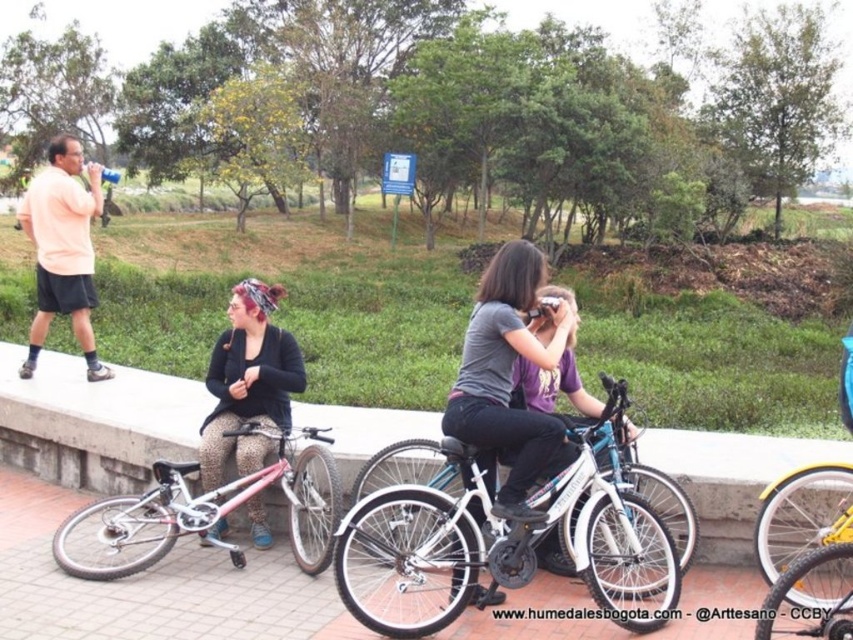
Between point (45, 349) and point (595, 534), which one is positioned behind?

Positioned behind is point (45, 349).

Between concrete ledge at center and white matte bicycle at center, which one has less height?

concrete ledge at center

Does point (836, 454) come behind point (469, 564)?

Yes, it is.

At what (x,y) coordinates should I click in order to perform the action: click on concrete ledge at center. Please return your answer as a coordinate pair (x, y). The height and width of the screenshot is (640, 853). Looking at the image, I should click on (94, 420).

Which is more to the right, matte gray shirt at center or leopard print pants at center?

From the viewer's perspective, matte gray shirt at center appears more on the right side.

Who is more distant from viewer, (512, 320) or (241, 408)?

The point (241, 408) is behind.

Image resolution: width=853 pixels, height=640 pixels. Identify the location of matte gray shirt at center. (506, 378).

The width and height of the screenshot is (853, 640). Identify the location of matte gray shirt at center. (506, 378).

Which is above, white matte bicycle at center or leopard print pants at center?

Positioned higher is leopard print pants at center.

Can you confirm if white matte bicycle at center is positioned above leopard print pants at center?

Actually, white matte bicycle at center is below leopard print pants at center.

Does point (345, 522) come closer to viewer compared to point (238, 310)?

That is True.

Find the location of a particular element. Image resolution: width=853 pixels, height=640 pixels. white matte bicycle at center is located at coordinates (509, 545).